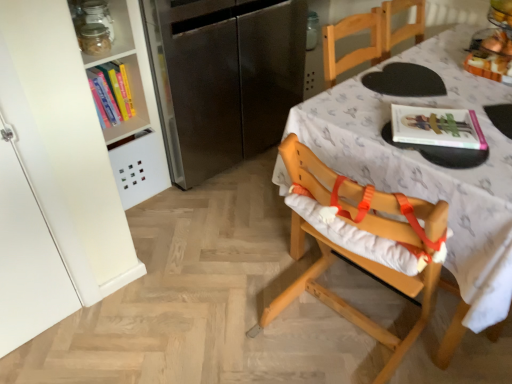
Locate an element on the screen. free space in front of stainless steel refrigerator at left is located at coordinates [x=216, y=219].